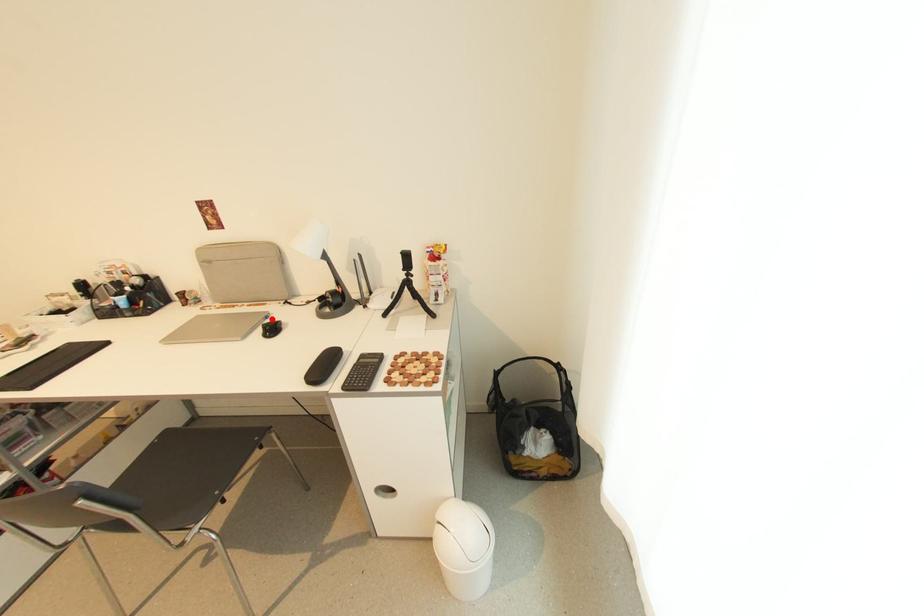
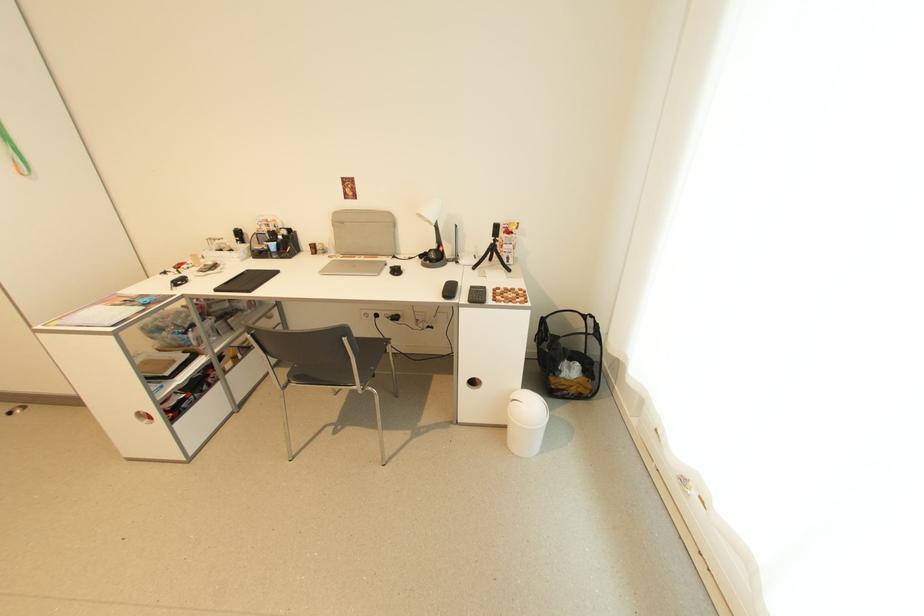
The point at the highlighted location is marked in the first image. Where is the corresponding point in the second image?

(391, 265)